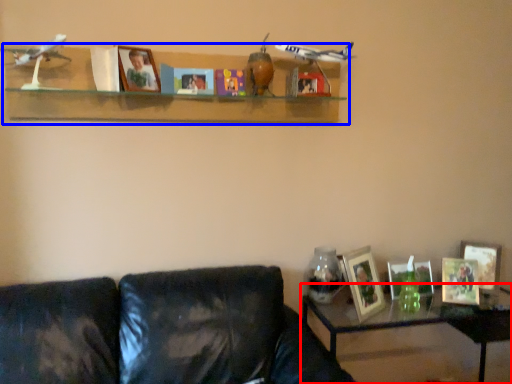
Question: Which object appears farthest to the camera in this image, table (highlighted by a red box) or shelf (highlighted by a blue box)?

Choices:
 (A) table
 (B) shelf

Answer: (A)